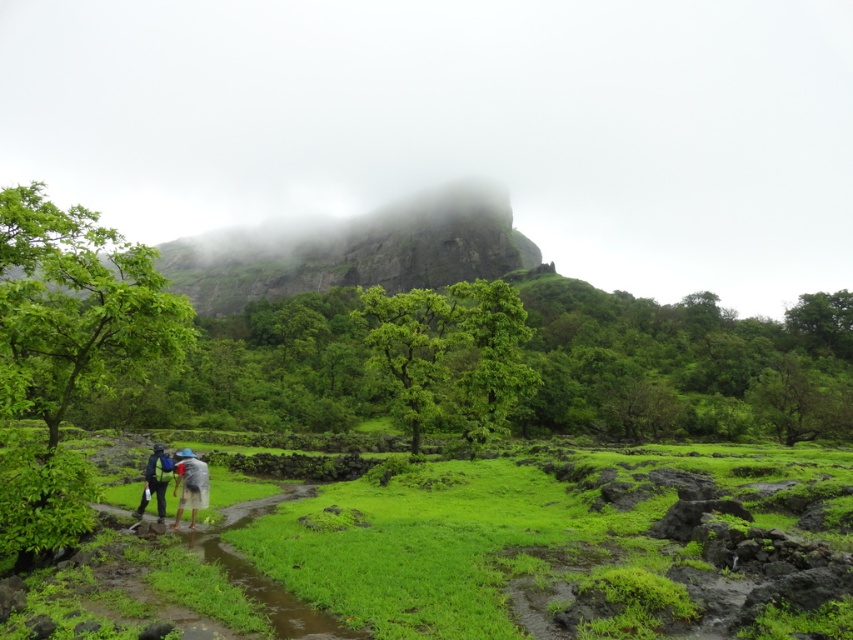
Does rocky cliff at upper center have a greater width compared to gray fabric umbrella at lower center?

Yes.

Identify the location of rocky cliff at upper center. (351, 252).

Between point (270, 236) and point (178, 493), which one is positioned behind?

Positioned behind is point (270, 236).

I want to click on rocky cliff at upper center, so click(x=351, y=252).

Is raincoat fabric couple at lower center below gray fabric umbrella at lower center?

Indeed, raincoat fabric couple at lower center is positioned under gray fabric umbrella at lower center.

Is point (152, 483) farther from viewer compared to point (190, 506)?

Yes, it is.

What do you see at coordinates (178, 484) in the screenshot? The width and height of the screenshot is (853, 640). I see `raincoat fabric couple at lower center` at bounding box center [178, 484].

Locate an element on the screen. This screenshot has width=853, height=640. raincoat fabric couple at lower center is located at coordinates (178, 484).

Consider the image. Is rocky cliff at upper center smaller than raincoat fabric couple at lower center?

Incorrect, rocky cliff at upper center is not smaller in size than raincoat fabric couple at lower center.

Can you confirm if rocky cliff at upper center is positioned to the right of raincoat fabric couple at lower center?

No, rocky cliff at upper center is not to the right of raincoat fabric couple at lower center.

Between point (485, 244) and point (160, 484), which one is positioned in front?

Point (160, 484) is more forward.

Identify the location of rocky cliff at upper center. (351, 252).